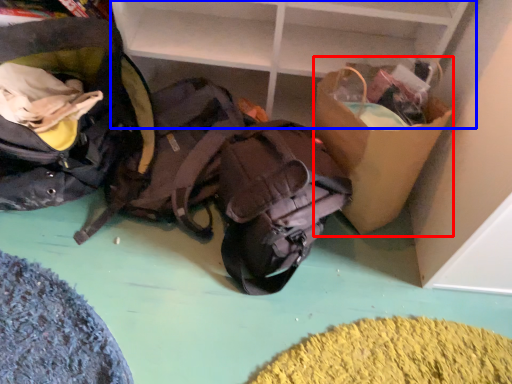
Question: Which of the following is the farthest to the observer, cardboard box (highlighted by a red box) or shelf (highlighted by a blue box)?

Choices:
 (A) cardboard box
 (B) shelf

Answer: (B)